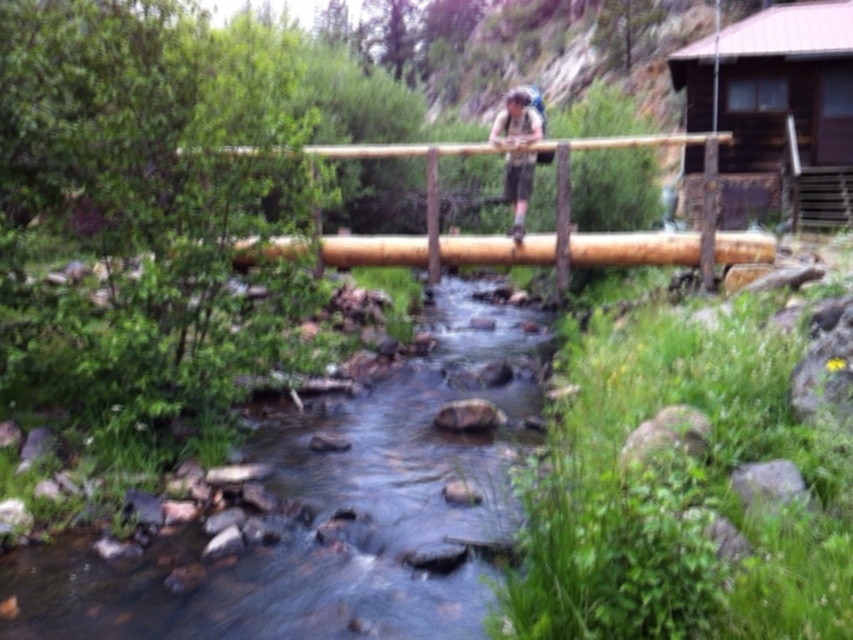
Question: Which point is closer to the camera?

Choices:
 (A) (705, 268)
 (B) (412, 248)

Answer: (A)

Question: In this image, where is brown wooden rail at center located relative to brown wooden pole at upper right?

Choices:
 (A) below
 (B) above

Answer: (A)

Question: Considering the relative positions of clear water at center and brown wooden pole at upper right in the image provided, where is clear water at center located with respect to brown wooden pole at upper right?

Choices:
 (A) below
 (B) above

Answer: (A)

Question: In this image, where is brown wooden cabin at upper right located relative to brown wooden pole at upper right?

Choices:
 (A) below
 (B) above

Answer: (A)

Question: Which point is closer to the camera?

Choices:
 (A) brown wooden rail at center
 (B) matte gray backpack at center

Answer: (A)

Question: Which point is farther to the camera?

Choices:
 (A) (698, 72)
 (B) (709, 134)
 (C) (724, 140)

Answer: (A)